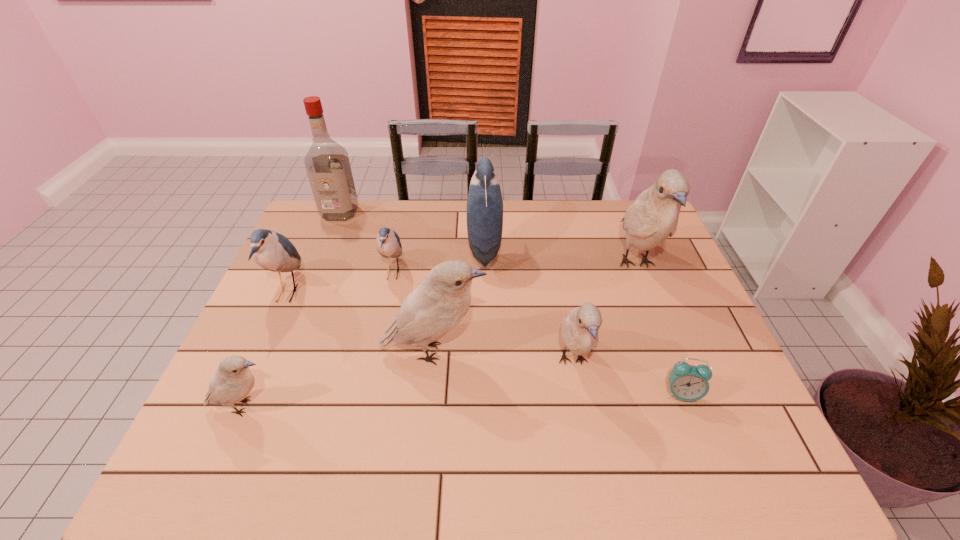
This screenshot has height=540, width=960. I want to click on liquor, so click(327, 164).

Locate an element on the screen. This screenshot has height=540, width=960. the biggest white bird is located at coordinates (653, 217).

Identify the location of the rightmost bird. The height and width of the screenshot is (540, 960). (653, 217).

Locate an element on the screen. The width and height of the screenshot is (960, 540). the biggest blue bird is located at coordinates (484, 204).

This screenshot has width=960, height=540. Find the location of `the second white bird from left to right`. the second white bird from left to right is located at coordinates (439, 303).

The image size is (960, 540). Find the location of `the leftmost blue bird`. the leftmost blue bird is located at coordinates (272, 251).

The height and width of the screenshot is (540, 960). I want to click on the seventh object from left to right, so click(579, 330).

You are a GUI agent. You are given a task and a screenshot of the screen. Output one action in this format:
    pyautogui.click(x=<x>, y=<y>)
    Task: Click on the second bird from right to left
    
    Given the screenshot: What is the action you would take?
    pyautogui.click(x=579, y=330)

Identify the location of the smallest blue bird. This screenshot has width=960, height=540. (388, 242).

Find the location of a particular element. This screenshot has width=960, height=540. the leftmost white bird is located at coordinates (232, 382).